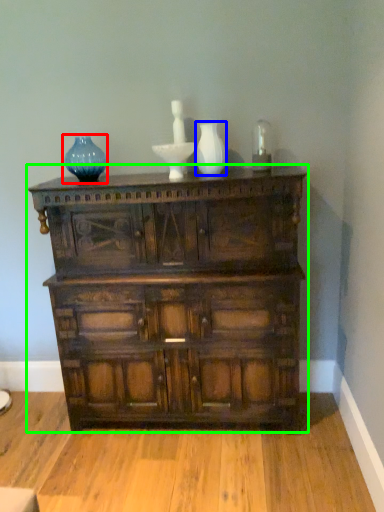
Question: Estimate the real-world distances between objects in this image. Which object is closer to vase (highlighted by a red box), glass vase (highlighted by a blue box) or chest of drawers (highlighted by a green box)?

Choices:
 (A) glass vase
 (B) chest of drawers

Answer: (A)